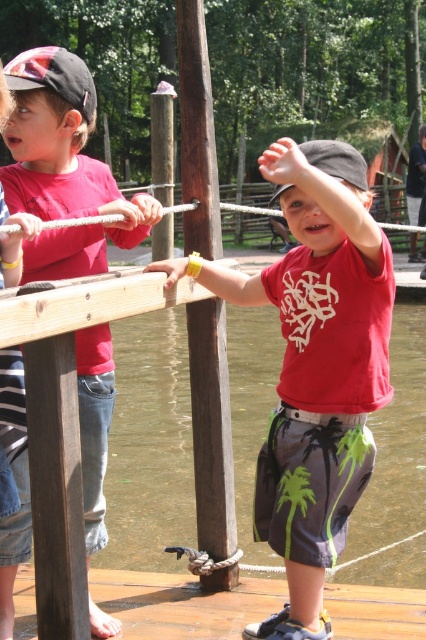
Between point (333, 468) and point (209, 612), which one is positioned behind?

The point (209, 612) is more distant.

Is matte red t-shirt at center above wooden dock at lower center?

Correct, matte red t-shirt at center is located above wooden dock at lower center.

The width and height of the screenshot is (426, 640). I want to click on matte red t-shirt at center, so click(314, 365).

Is point (40, 65) farther from camera compared to point (207, 616)?

That is False.

Who is positioned more to the right, matte red shirt at left or wooden dock at lower center?

wooden dock at lower center

Between point (108, 364) and point (184, 600), which one is positioned behind?

The point (184, 600) is more distant.

Locate an element on the screen. matte red shirt at left is located at coordinates (63, 168).

Based on the photo, who is lower down, brown water at lower center or matte red shirt at left?

brown water at lower center is below.

Which is more to the left, brown water at lower center or matte red shirt at left?

Positioned to the left is matte red shirt at left.

Which is behind, point (6, 333) or point (46, 61)?

Point (46, 61)

This screenshot has height=640, width=426. Identify the location of brown water at lower center. (132, 404).